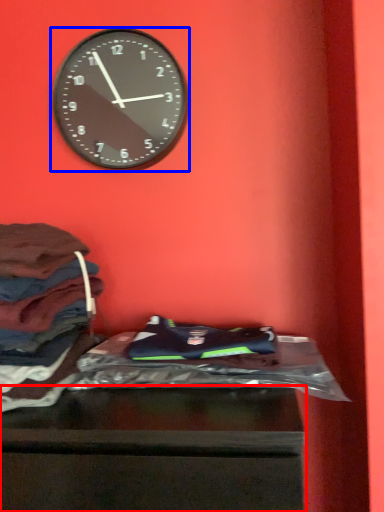
Question: Which object appears farthest to the camera in this image, furniture (highlighted by a red box) or wall clock (highlighted by a blue box)?

Choices:
 (A) furniture
 (B) wall clock

Answer: (B)